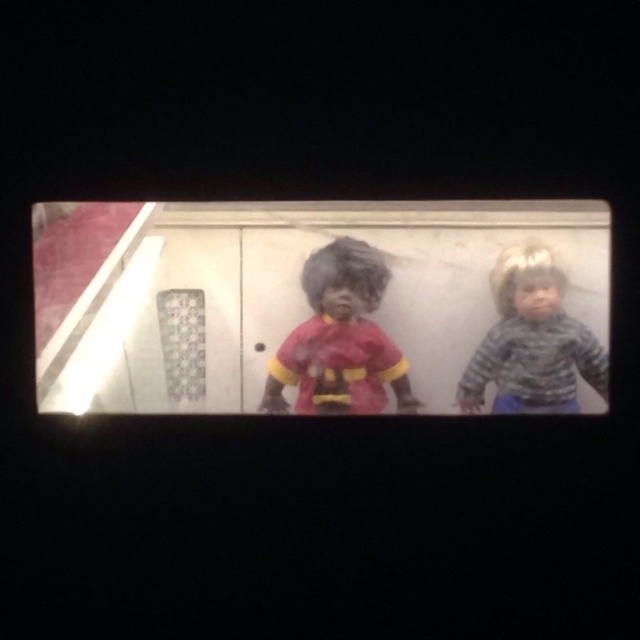
Question: In this image, where is matte red fabric doll at center located relative to camouflage sweater at right?

Choices:
 (A) above
 (B) below

Answer: (A)

Question: Does matte red fabric doll at center appear over camouflage sweater at right?

Choices:
 (A) no
 (B) yes

Answer: (B)

Question: Does matte red fabric doll at center appear on the right side of camouflage sweater at right?

Choices:
 (A) no
 (B) yes

Answer: (A)